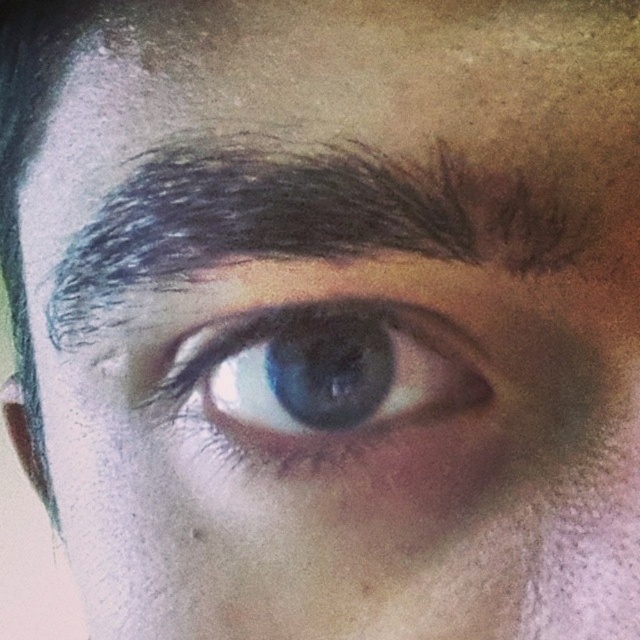
Question: Does dark brown hair at upper center come in front of blue glossy eye at center?

Choices:
 (A) no
 (B) yes

Answer: (B)

Question: Can you confirm if dark brown hair at upper center is wider than blue glossy eye at center?

Choices:
 (A) yes
 (B) no

Answer: (A)

Question: Can you confirm if dark brown hair at upper center is smaller than blue glossy eye at center?

Choices:
 (A) no
 (B) yes

Answer: (A)

Question: Which point is closer to the camera taking this photo?

Choices:
 (A) (307, 324)
 (B) (512, 266)

Answer: (B)